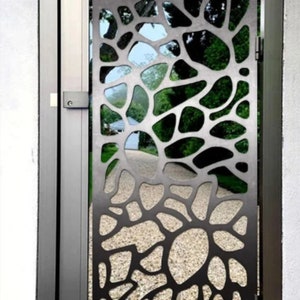
The height and width of the screenshot is (300, 300). Identify the location of window. (204, 51).